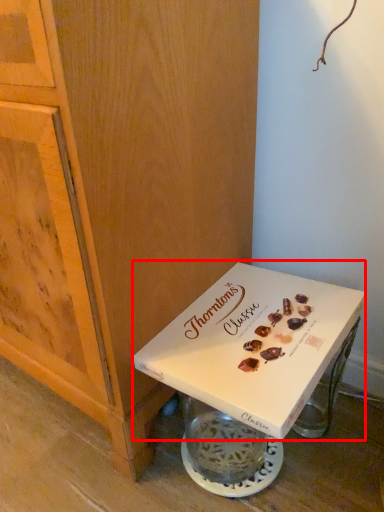
Question: From the image's perspective, what is the correct spatial positioning of box (annotated by the red box) in reference to cabinetry?

Choices:
 (A) below
 (B) above

Answer: (A)